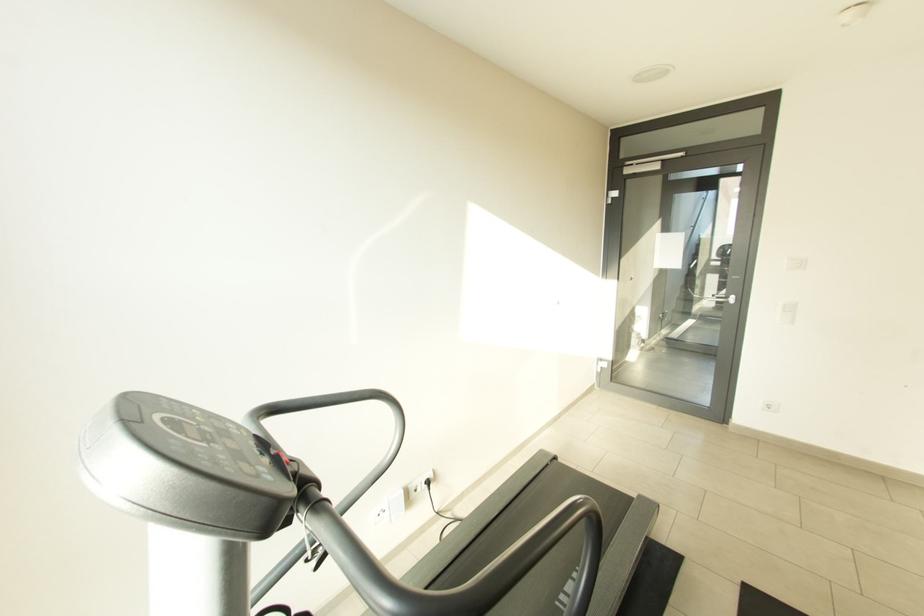
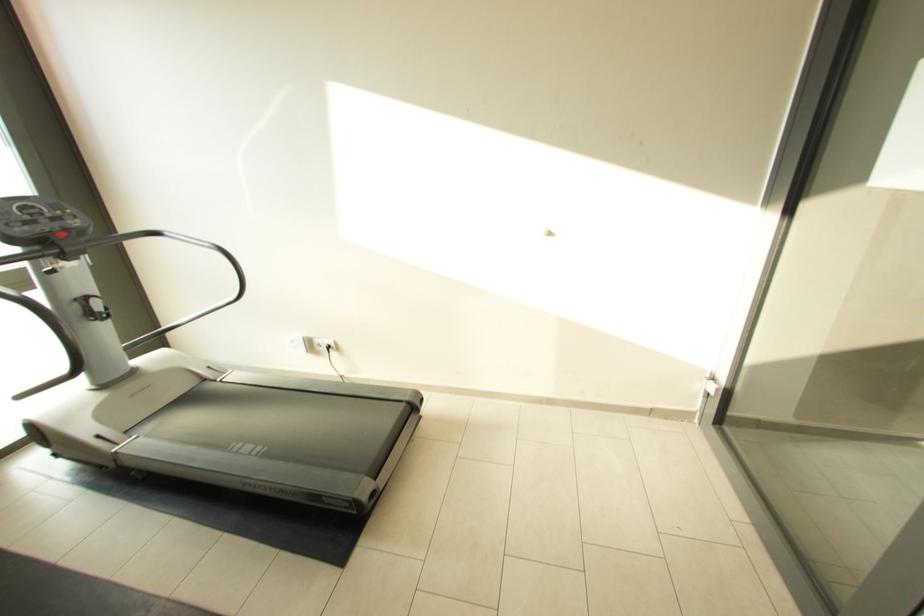
Find the pixel in the second image that matches [417,488] in the first image.

(322, 342)